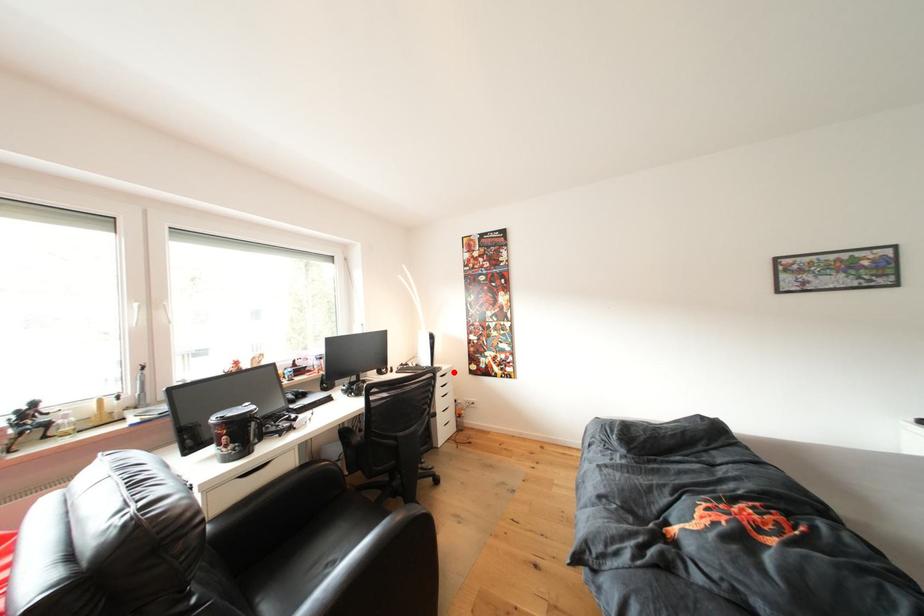
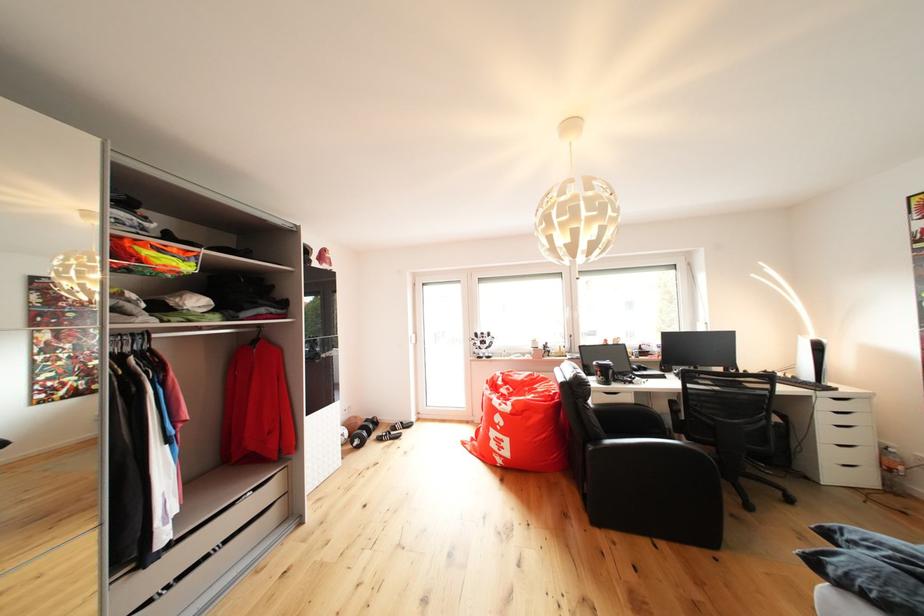
Question: A red point is marked in image1. In image2, is the corresponding 3D point closer to the camera or farther? Reply with the corresponding letter.

Choices:
 (A) The corresponding 3D point is closer.
 (B) The corresponding 3D point is farther.

Answer: (A)